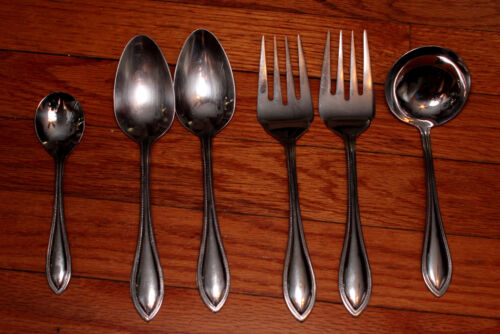
The width and height of the screenshot is (500, 334). In order to click on table in this screenshot , I will do (265, 261).